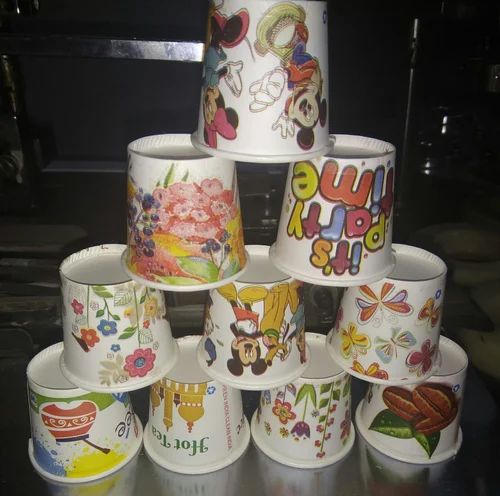
The image size is (500, 496). What are the coordinates of `decorative painted cocoa beans` in the screenshot? It's located at click(x=429, y=404), click(x=400, y=408), click(x=435, y=423).